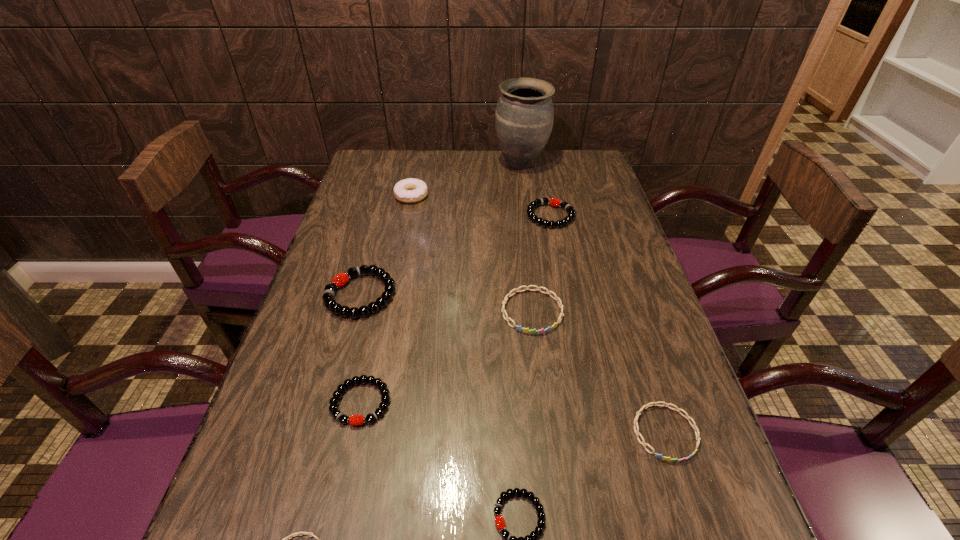
Identify the location of blank space that satisfies the following two spatial constraints: 1. on the back side of the tallest object; 2. on the right side of the doughnut. The image size is (960, 540). (418, 164).